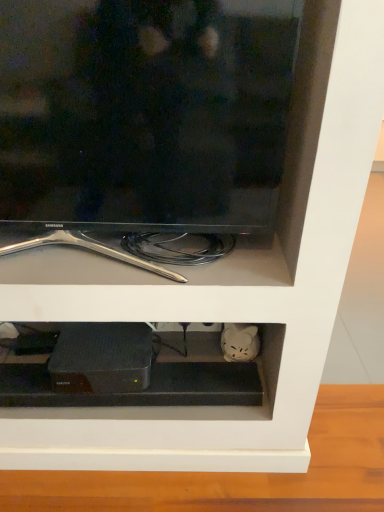
Question: Does black matte router at lower center lie in front of black glossy tv at upper center?

Choices:
 (A) no
 (B) yes

Answer: (A)

Question: Is black glossy tv at upper center inside black matte router at lower center?

Choices:
 (A) yes
 (B) no

Answer: (B)

Question: Is black matte router at lower center bigger than black glossy tv at upper center?

Choices:
 (A) no
 (B) yes

Answer: (A)

Question: Can you confirm if black matte router at lower center is wider than black glossy tv at upper center?

Choices:
 (A) yes
 (B) no

Answer: (A)

Question: Is black matte router at lower center taller than black glossy tv at upper center?

Choices:
 (A) no
 (B) yes

Answer: (A)

Question: From the image's perspective, relative to black matte router at lower center, is black glossy tv at upper center above or below?

Choices:
 (A) above
 (B) below

Answer: (A)

Question: Considering the positions of black glossy tv at upper center and black matte router at lower center in the image, is black glossy tv at upper center wider or thinner than black matte router at lower center?

Choices:
 (A) wide
 (B) thin

Answer: (B)

Question: Considering the positions of black glossy tv at upper center and black matte router at lower center in the image, is black glossy tv at upper center bigger or smaller than black matte router at lower center?

Choices:
 (A) big
 (B) small

Answer: (A)

Question: Does point pos(175,175) appear closer or farther from the camera than point pos(87,336)?

Choices:
 (A) farther
 (B) closer

Answer: (B)

Question: Is point (112, 333) positioned closer to the camera than point (193, 132)?

Choices:
 (A) farther
 (B) closer

Answer: (A)

Question: Is black matte router at lower center spatially inside black glossy tv at upper center, or outside of it?

Choices:
 (A) inside
 (B) outside

Answer: (B)

Question: Is black matte router at lower center bigger or smaller than black glossy tv at upper center?

Choices:
 (A) big
 (B) small

Answer: (B)

Question: From the image's perspective, is black matte router at lower center above or below black glossy tv at upper center?

Choices:
 (A) below
 (B) above

Answer: (A)

Question: From the image's perspective, relative to black matte device at center, is black glossy tv at upper center above or below?

Choices:
 (A) below
 (B) above

Answer: (B)

Question: Based on their positions, is black glossy tv at upper center located to the left or right of black matte device at center?

Choices:
 (A) right
 (B) left

Answer: (A)